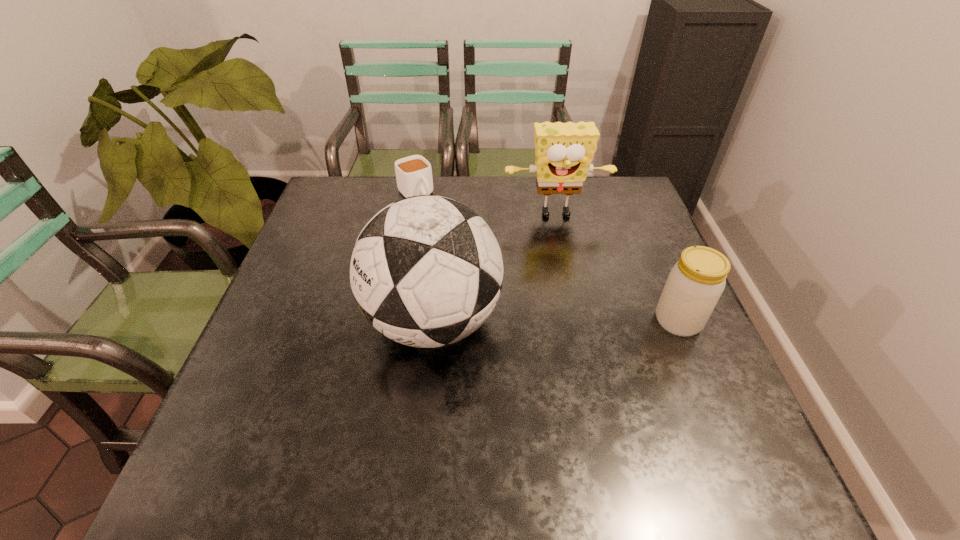
This screenshot has height=540, width=960. Identify the location of object that stands as the third closest to the third tallest object. (413, 174).

The height and width of the screenshot is (540, 960). Identify the location of vacant position in the image that satisfies the following two spatial constraints: 1. on the front side of the shortest object; 2. on the surface of the soccer ball where the brand logo is visible. (392, 321).

The height and width of the screenshot is (540, 960). I want to click on vacant space that satisfies the following two spatial constraints: 1. on the front side of the cup; 2. on the surface of the soccer ball where the brand logo is visible, so click(x=392, y=321).